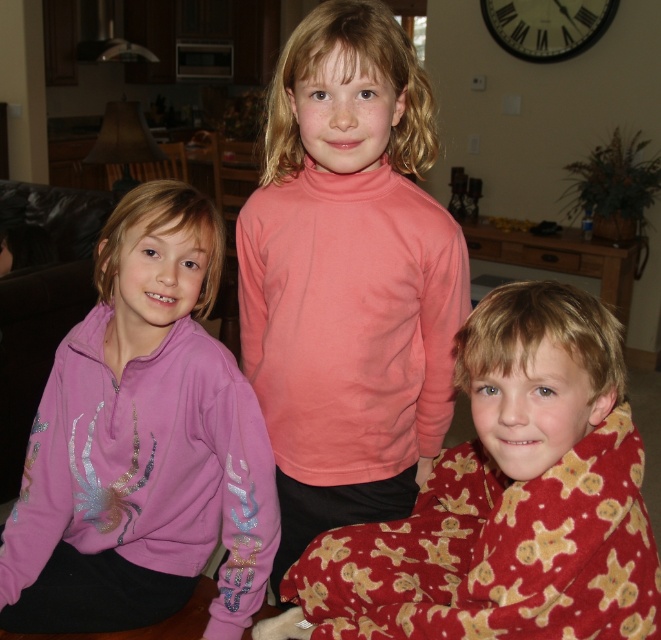
Who is taller, pink glittery hoodie at left or fluffy red pajamas at lower right?

pink glittery hoodie at left is taller.

Consider the image. Between pink glittery hoodie at left and fluffy red pajamas at lower right, which one is positioned higher?

Positioned higher is pink glittery hoodie at left.

What are the coordinates of `pink glittery hoodie at left` in the screenshot? It's located at (141, 444).

Based on the photo, between pink matte turtleneck at center and fluffy red pajamas at lower right, which one has less height?

fluffy red pajamas at lower right

Between point (453, 225) and point (401, 547), which one is positioned in front?

Positioned in front is point (401, 547).

The width and height of the screenshot is (661, 640). Find the location of `pink matte turtleneck at center`. pink matte turtleneck at center is located at coordinates (348, 276).

Image resolution: width=661 pixels, height=640 pixels. Identify the location of pink matte turtleneck at center. (348, 276).

The height and width of the screenshot is (640, 661). I want to click on pink matte turtleneck at center, so click(x=348, y=276).